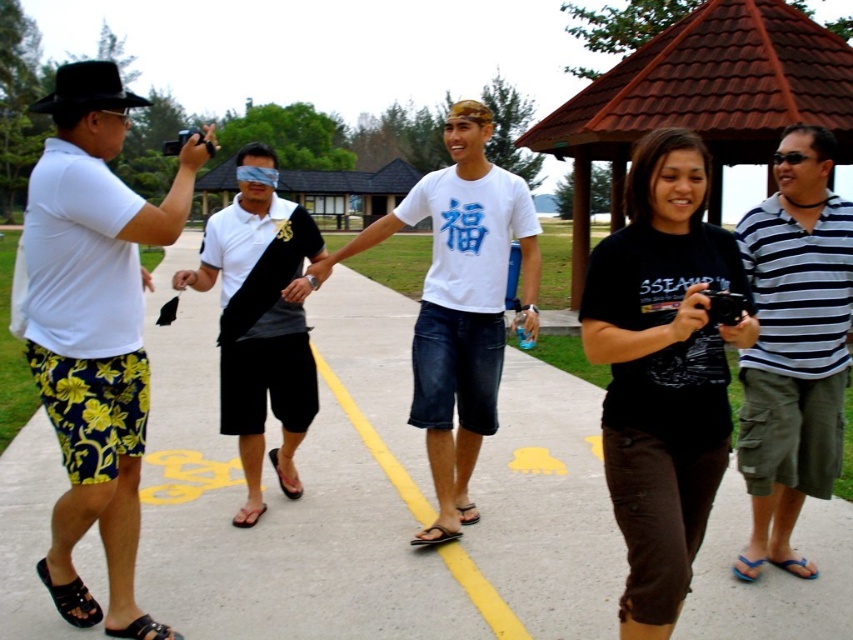
You are standing at point (701, 99) in the image. What object are you directly facing?

The brown tiled gazebo at upper center is located at point (701, 99), so you are directly facing the brown tiled gazebo at upper center.